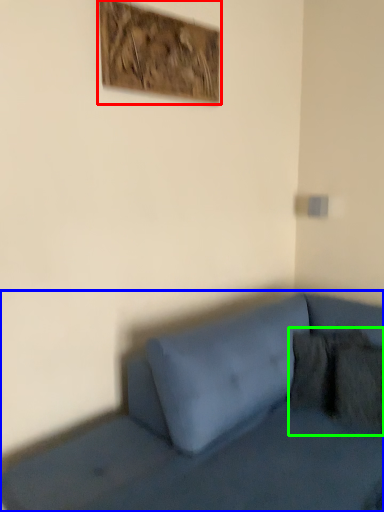
Question: Which object is the closest to the picture frame (highlighted by a red box)? Choose among these: studio couch (highlighted by a blue box) or pillow (highlighted by a green box).

Choices:
 (A) studio couch
 (B) pillow

Answer: (A)